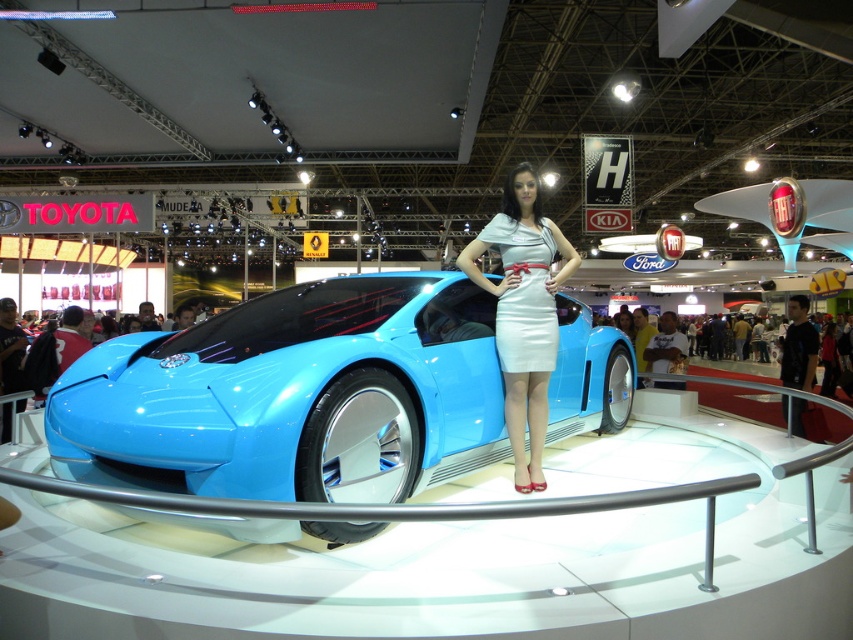
Question: Does glossy blue car at center appear over white satin dress at center?

Choices:
 (A) no
 (B) yes

Answer: (A)

Question: Can you confirm if glossy blue car at center is positioned above white satin dress at center?

Choices:
 (A) no
 (B) yes

Answer: (A)

Question: Which point appears closest to the camera in this image?

Choices:
 (A) (531, 189)
 (B) (166, 490)

Answer: (B)

Question: Is the position of glossy blue car at center more distant than that of white satin dress at center?

Choices:
 (A) yes
 (B) no

Answer: (B)

Question: Which of the following is the farthest from the observer?

Choices:
 (A) pos(541,472)
 (B) pos(107,445)

Answer: (A)

Question: Which point is farther from the camera taking this photo?

Choices:
 (A) (549, 308)
 (B) (338, 317)

Answer: (A)